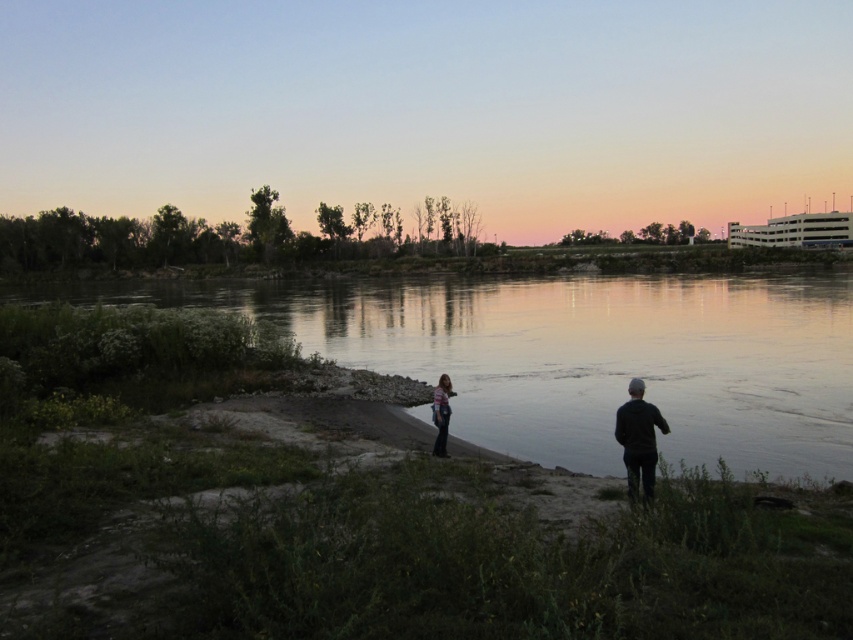
Is smooth water at center thinner than striped fabric person at center?

In fact, smooth water at center might be wider than striped fabric person at center.

Is point (755, 449) closer to viewer compared to point (447, 404)?

No, it is not.

Where is `smooth water at center`? The width and height of the screenshot is (853, 640). smooth water at center is located at coordinates (579, 356).

Between point (654, 412) and point (440, 422), which one is positioned behind?

The point (440, 422) is more distant.

Consider the image. Who is positioned more to the left, dark green jacket at lower right or striped fabric person at center?

striped fabric person at center

Describe the element at coordinates (637, 440) in the screenshot. I see `dark green jacket at lower right` at that location.

This screenshot has width=853, height=640. I want to click on dark green jacket at lower right, so click(x=637, y=440).

Does smooth water at center appear over dark green jacket at lower right?

Correct, smooth water at center is located above dark green jacket at lower right.

Can you confirm if smooth water at center is positioned to the right of dark green jacket at lower right?

In fact, smooth water at center is to the left of dark green jacket at lower right.

Where is `smooth water at center`? The image size is (853, 640). smooth water at center is located at coordinates (579, 356).

The image size is (853, 640). I want to click on smooth water at center, so click(579, 356).